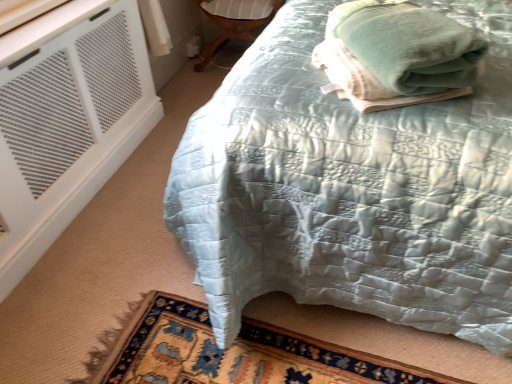
Question: From a real-world perspective, is matte wood side table at lower center beneath green soft towel at upper right?

Choices:
 (A) no
 (B) yes

Answer: (B)

Question: Is matte wood side table at lower center smaller than green soft towel at upper right?

Choices:
 (A) no
 (B) yes

Answer: (A)

Question: Is matte wood side table at lower center not inside green soft towel at upper right?

Choices:
 (A) no
 (B) yes

Answer: (B)

Question: From the image's perspective, would you say matte wood side table at lower center is shown under green soft towel at upper right?

Choices:
 (A) yes
 (B) no

Answer: (B)

Question: Does matte wood side table at lower center have a lesser height compared to green soft towel at upper right?

Choices:
 (A) no
 (B) yes

Answer: (A)

Question: Is green soft towel at upper right inside matte wood side table at lower center?

Choices:
 (A) no
 (B) yes

Answer: (A)

Question: Is white mesh air conditioning at lower left positioned in front of silky blue quilt at center?

Choices:
 (A) yes
 (B) no

Answer: (B)

Question: Can you confirm if white mesh air conditioning at lower left is positioned to the right of silky blue quilt at center?

Choices:
 (A) no
 (B) yes

Answer: (A)

Question: Considering the relative sizes of white mesh air conditioning at lower left and silky blue quilt at center in the image provided, is white mesh air conditioning at lower left thinner than silky blue quilt at center?

Choices:
 (A) yes
 (B) no

Answer: (A)

Question: Is silky blue quilt at center completely or partially inside white mesh air conditioning at lower left?

Choices:
 (A) no
 (B) yes

Answer: (A)

Question: Does white mesh air conditioning at lower left have a smaller size compared to silky blue quilt at center?

Choices:
 (A) no
 (B) yes

Answer: (B)

Question: Is white mesh air conditioning at lower left positioned behind silky blue quilt at center?

Choices:
 (A) yes
 (B) no

Answer: (A)

Question: Can you confirm if green soft towel at upper right is smaller than matte wood side table at lower center?

Choices:
 (A) no
 (B) yes

Answer: (B)